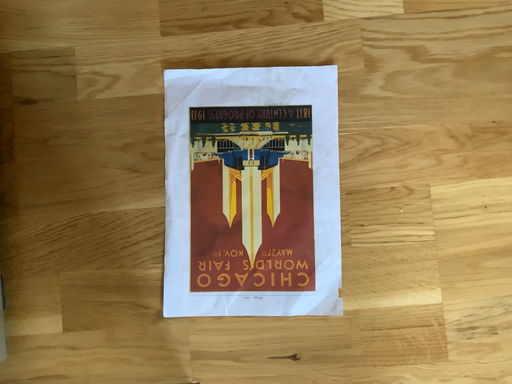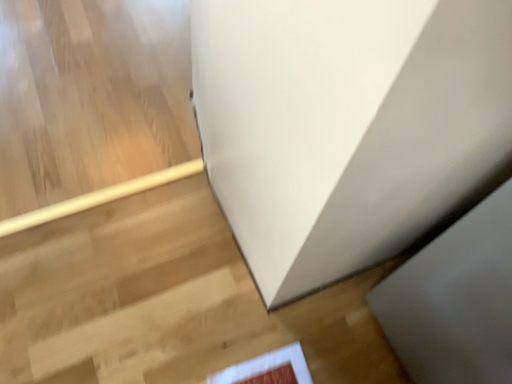
Question: How did the camera likely rotate when shooting the video?

Choices:
 (A) rotated upward
 (B) rotated downward

Answer: (A)